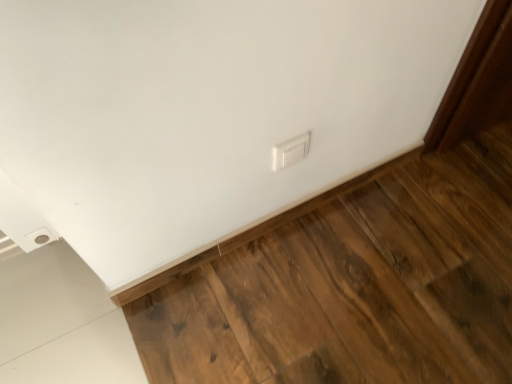
Question: Is brown wood flooring at lower right further to the viewer compared to white plastic switch at center?

Choices:
 (A) no
 (B) yes

Answer: (A)

Question: Is brown wood flooring at lower right far away from white plastic switch at center?

Choices:
 (A) no
 (B) yes

Answer: (A)

Question: Is brown wood flooring at lower right aimed at white plastic switch at center?

Choices:
 (A) yes
 (B) no

Answer: (B)

Question: From a real-world perspective, is brown wood flooring at lower right physically below white plastic switch at center?

Choices:
 (A) no
 (B) yes

Answer: (B)

Question: Does brown wood flooring at lower right have a greater height compared to white plastic switch at center?

Choices:
 (A) no
 (B) yes

Answer: (A)

Question: Is brown wood flooring at lower right smaller than white plastic switch at center?

Choices:
 (A) no
 (B) yes

Answer: (A)

Question: Can you confirm if white plastic switch at center is positioned to the left of brown wood flooring at lower right?

Choices:
 (A) yes
 (B) no

Answer: (B)

Question: From the image's perspective, does white plastic switch at center appear lower than brown wood flooring at lower right?

Choices:
 (A) yes
 (B) no

Answer: (B)

Question: Does white plastic switch at center come behind brown wood flooring at lower right?

Choices:
 (A) yes
 (B) no

Answer: (A)

Question: Does white plastic switch at center have a lesser height compared to brown wood flooring at lower right?

Choices:
 (A) no
 (B) yes

Answer: (A)

Question: From a real-world perspective, is white plastic switch at center positioned under brown wood flooring at lower right based on gravity?

Choices:
 (A) no
 (B) yes

Answer: (A)

Question: Is white plastic switch at center turned away from brown wood flooring at lower right?

Choices:
 (A) yes
 (B) no

Answer: (B)

Question: Looking at their shapes, would you say brown wood flooring at lower right is wider or thinner than white plastic switch at center?

Choices:
 (A) thin
 (B) wide

Answer: (B)